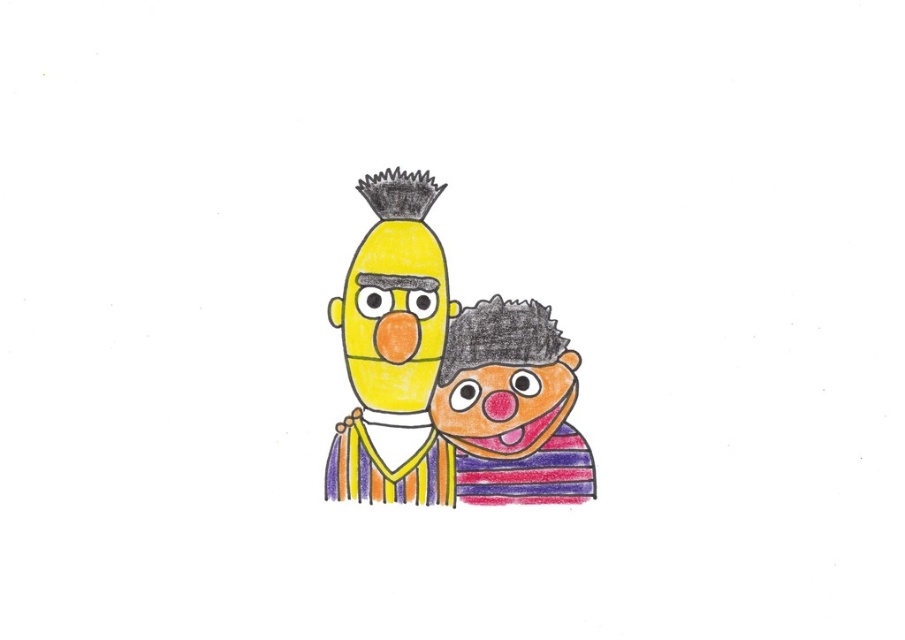
You are an artist trying to paint the two characters in the scene. You need to place a highlight on the striped fabric face at right. According to the drawing, where should you place the highlight? Please provide the coordinates in the format of a point like point (517, 406).

The striped fabric face at right is represented by point (517, 406), so you should place the highlight at point (517, 406).

Based on the coordinates provided in the description, where is the striped fabric face at right located in the image?

The striped fabric face at right is located at point coordinates of (517, 406).